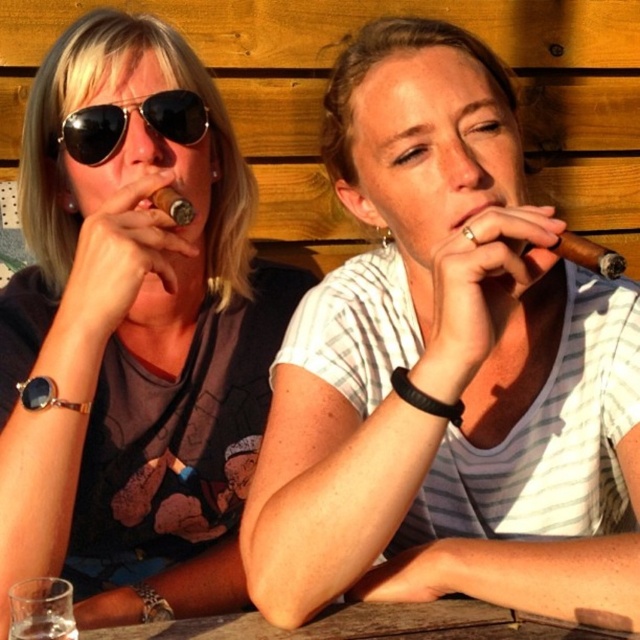
Question: Among these objects, which one is nearest to the camera?

Choices:
 (A) wooden table at lower center
 (B) matte brown cigar at center
 (C) matte black cigar at center
 (D) black aviator sunglasses at upper left

Answer: (B)

Question: Does matte black cigar at center have a larger size compared to black aviator sunglasses at upper left?

Choices:
 (A) yes
 (B) no

Answer: (A)

Question: Which of these objects is positioned farthest from the wooden table at lower center?

Choices:
 (A) matte brown cigar at center
 (B) black aviator sunglasses at upper left
 (C) matte black cigar at center

Answer: (B)

Question: Does matte brown cigar at center have a larger size compared to wooden table at lower center?

Choices:
 (A) yes
 (B) no

Answer: (A)

Question: Can you confirm if matte black cigar at center is positioned below wooden table at lower center?

Choices:
 (A) yes
 (B) no

Answer: (B)

Question: Among these points, which one is nearest to the camera?

Choices:
 (A) (449, 624)
 (B) (282, 586)
 (C) (180, 125)

Answer: (B)